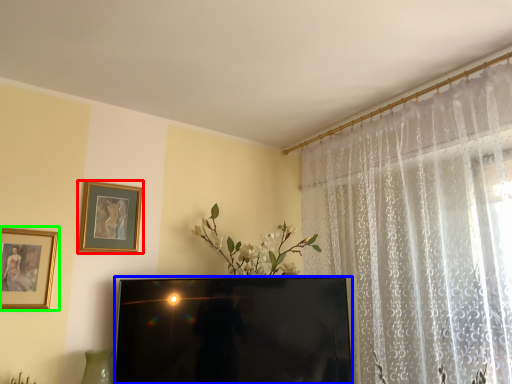
Question: Which is nearer to the picture frame (highlighted by a red box)? television (highlighted by a blue box) or picture frame (highlighted by a green box).

Choices:
 (A) television
 (B) picture frame

Answer: (B)